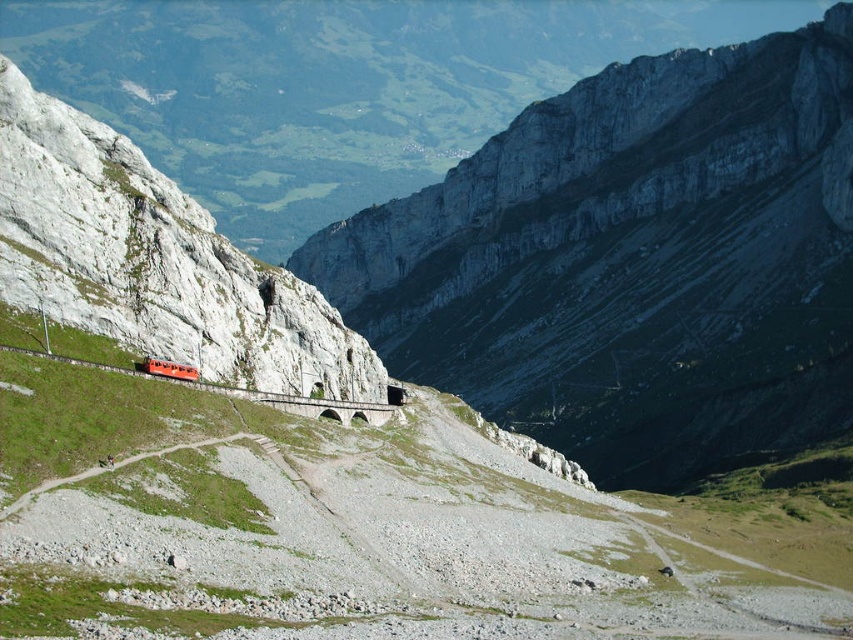
Question: Which point appears farthest from the camera in this image?

Choices:
 (A) [x=96, y=243]
 (B) [x=144, y=371]

Answer: (A)

Question: Is matte red train at left below matte orange train at center?

Choices:
 (A) yes
 (B) no

Answer: (B)

Question: Which point is farther to the camera?

Choices:
 (A) 335,349
 (B) 192,371

Answer: (A)

Question: Does matte red train at left appear under matte orange train at center?

Choices:
 (A) no
 (B) yes

Answer: (A)

Question: Among these objects, which one is farthest from the camera?

Choices:
 (A) matte red train at left
 (B) matte orange train at center

Answer: (B)

Question: Observing the image, what is the correct spatial positioning of matte red train at left in reference to matte orange train at center?

Choices:
 (A) left
 (B) right

Answer: (A)